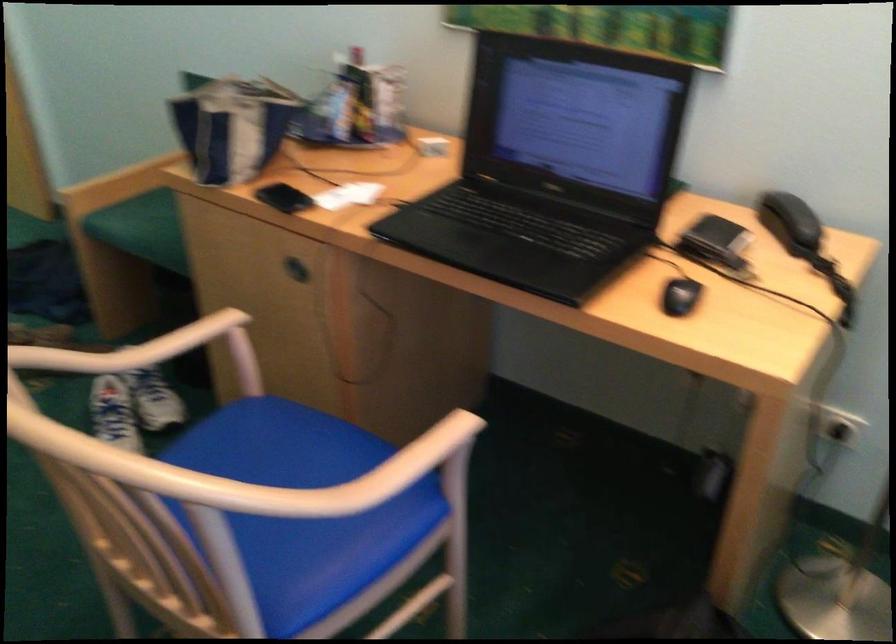
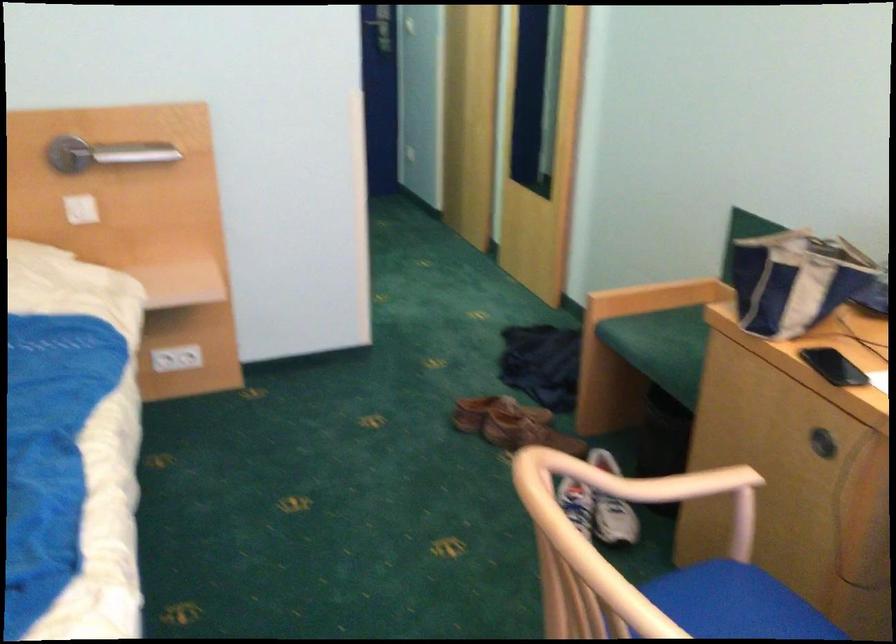
Find the pixel in the second image that matches the point at 228,428 in the first image.

(711, 590)